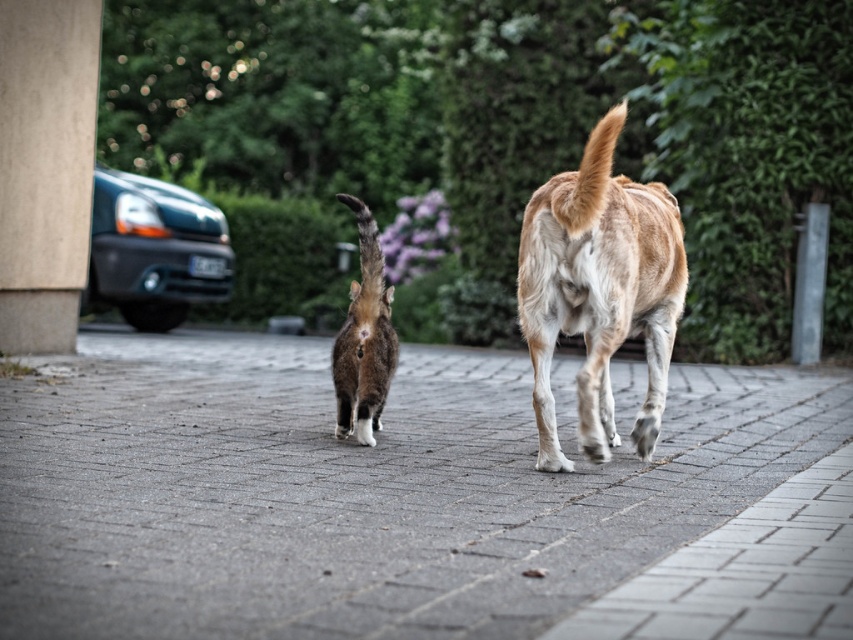
You are a delivery person trying to park your van in a narrow alley. The alley has a smooth concrete pillar at left and a matte black van at left. Can you park your van without hitting the pillar?

The smooth concrete pillar at left is smaller than the matte black van at left, so the pillar is narrower than the van. Since your van is likely similar in size to the matte black van at left, you should have enough space to park without hitting the pillar as long as you stay aligned properly.

You are a painter standing in front of the scene, and you need to paint the objects on the left side of the image. Which object should you paint first, the smooth concrete pillar at left or the matte black van at left, considering their widths?

The smooth concrete pillar at left has a smaller width than the matte black van at left, so you should paint the matte black van at left first since it is wider and might cover more of the left side area.

Looking at this image, you are a delivery robot that is 1.5 meters wide. You need to move from the gray concrete pavement at center to the light brown fur dog at center. Can you fit through the space between them?

The gray concrete pavement at center and light brown fur dog at center are 1.61 meters apart, so the delivery robot can fit through the space since its width is 1.5 meters, which is less than the 1.61 meters between them.